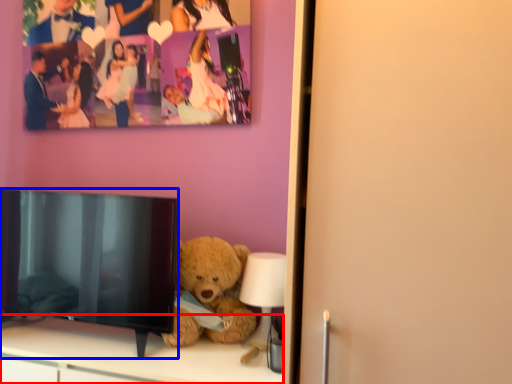
Question: Which object appears closest to the camera in this image, furniture (highlighted by a red box) or television (highlighted by a blue box)?

Choices:
 (A) furniture
 (B) television

Answer: (A)